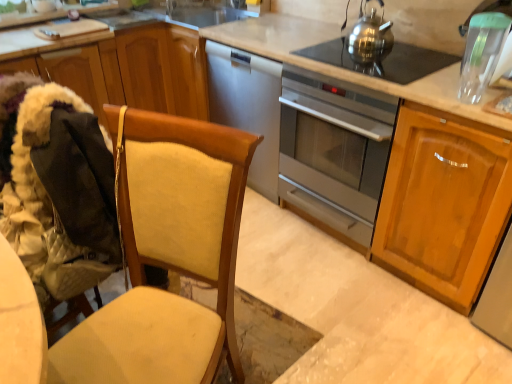
Identify the location of free spot above satin silver oven at center (from a real-world perspective). The height and width of the screenshot is (384, 512). (351, 58).